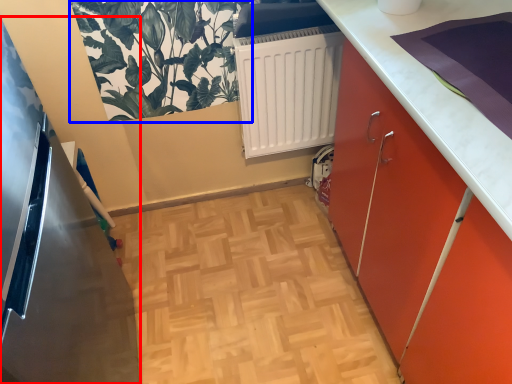
Question: Which of the following is the farthest to the observer, appliance (highlighted by a red box) or plant (highlighted by a blue box)?

Choices:
 (A) appliance
 (B) plant

Answer: (B)